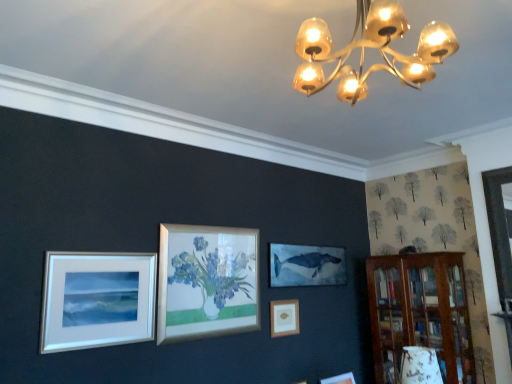
Question: Can you see wooden bookshelf at right touching white matte picture frame at lower left, the 2th picture frame from the right?

Choices:
 (A) no
 (B) yes

Answer: (A)

Question: Are wooden bookshelf at right and white matte picture frame at lower left, which is the 1th picture frame from top to bottom, far apart?

Choices:
 (A) yes
 (B) no

Answer: (A)

Question: Is wooden bookshelf at right taller than white matte picture frame at lower left, the first picture frame from the left?

Choices:
 (A) yes
 (B) no

Answer: (A)

Question: Is wooden bookshelf at right turned away from white matte picture frame at lower left, the 2th picture frame from the right?

Choices:
 (A) yes
 (B) no

Answer: (B)

Question: From the image's perspective, does wooden bookshelf at right appear lower than white matte picture frame at lower left, the first picture frame from the left?

Choices:
 (A) no
 (B) yes

Answer: (B)

Question: Does wooden bookshelf at right appear on the right side of white matte picture frame at lower left, which ranks as the 1th picture frame in front-to-back order?

Choices:
 (A) yes
 (B) no

Answer: (A)

Question: Are white matte picture frame at lower left, which ranks as the 1th picture frame in front-to-back order, and wooden frame at center, the first picture frame viewed from the back, beside each other?

Choices:
 (A) yes
 (B) no

Answer: (B)

Question: From a real-world perspective, is white matte picture frame at lower left, the 2th picture frame from the right, positioned under wooden frame at center, the 2th picture frame viewed from the front, based on gravity?

Choices:
 (A) no
 (B) yes

Answer: (A)

Question: From the image's perspective, does white matte picture frame at lower left, the first picture frame from the left, appear lower than wooden frame at center, the 1th picture frame from the bottom?

Choices:
 (A) no
 (B) yes

Answer: (A)

Question: Is white matte picture frame at lower left, the 2th picture frame from the right, taller than wooden frame at center, the 2th picture frame viewed from the left?

Choices:
 (A) yes
 (B) no

Answer: (A)

Question: Does white matte picture frame at lower left, which is the second picture frame from bottom to top, appear on the left side of wooden frame at center, the 1th picture frame from the bottom?

Choices:
 (A) no
 (B) yes

Answer: (B)

Question: Is white matte picture frame at lower left, which is the second picture frame from bottom to top, behind wooden frame at center, the 1th picture frame when ordered from right to left?

Choices:
 (A) yes
 (B) no

Answer: (B)

Question: Can you confirm if wooden bookshelf at right is wider than wooden frame at center, the 2th picture frame viewed from the front?

Choices:
 (A) yes
 (B) no

Answer: (A)